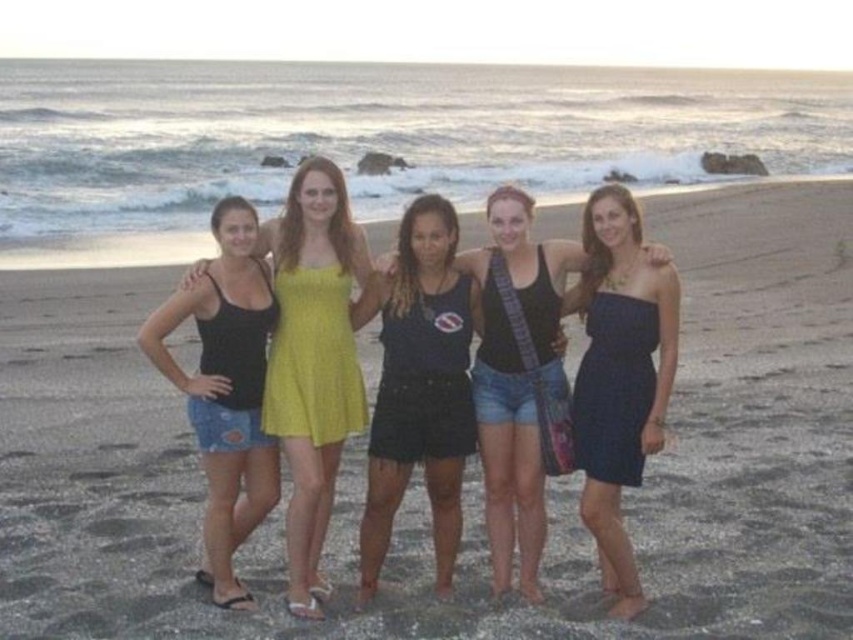
In the scene shown: Who is positioned more to the right, smooth sand at center or denim shorts at left?

Positioned to the right is smooth sand at center.

Is smooth sand at center thinner than denim shorts at left?

No, smooth sand at center is not thinner than denim shorts at left.

Is point (473, 637) less distant than point (210, 278)?

Yes, it is in front of point (210, 278).

Locate an element on the screen. This screenshot has height=640, width=853. smooth sand at center is located at coordinates (467, 465).

Which is more to the left, navy blue strapless dress at center or dark blue tank top at center?

dark blue tank top at center

Does navy blue strapless dress at center have a greater height compared to dark blue tank top at center?

Indeed, navy blue strapless dress at center has a greater height compared to dark blue tank top at center.

Identify the location of navy blue strapless dress at center. This screenshot has height=640, width=853. (619, 376).

The image size is (853, 640). What do you see at coordinates (315, 356) in the screenshot?
I see `matte yellow dress at center` at bounding box center [315, 356].

Which is below, matte yellow dress at center or dark blue tank top at center?

dark blue tank top at center is lower down.

Who is more forward, (341,276) or (532,317)?

Positioned in front is point (341,276).

Locate an element on the screen. matte yellow dress at center is located at coordinates (315, 356).